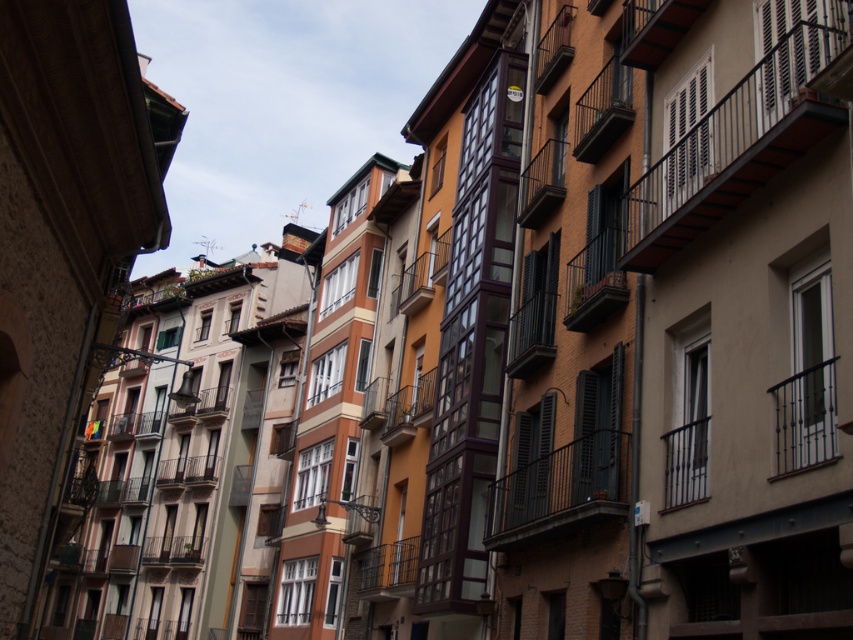
Question: Does metallic black balcony at upper right appear over wooden balcony at center?

Choices:
 (A) yes
 (B) no

Answer: (A)

Question: Is metallic silver balcony at center bigger than wooden balcony at center?

Choices:
 (A) yes
 (B) no

Answer: (B)

Question: Which is nearer to the black metal balcony at center?

Choices:
 (A) wooden brown balcony at center
 (B) metallic black balcony at upper right
 (C) wooden dark brown balcony at center

Answer: (A)

Question: Which object is closer to the camera taking this photo?

Choices:
 (A) black metal balcony at upper center
 (B) wooden balcony at center

Answer: (A)

Question: In this image, where is metallic black balcony at upper right located relative to black metal balcony at center?

Choices:
 (A) left
 (B) right

Answer: (B)

Question: Which point appears closest to the camera in this image?

Choices:
 (A) (538, 513)
 (B) (113, 440)
 (C) (579, 288)
 (D) (712, 189)

Answer: (D)